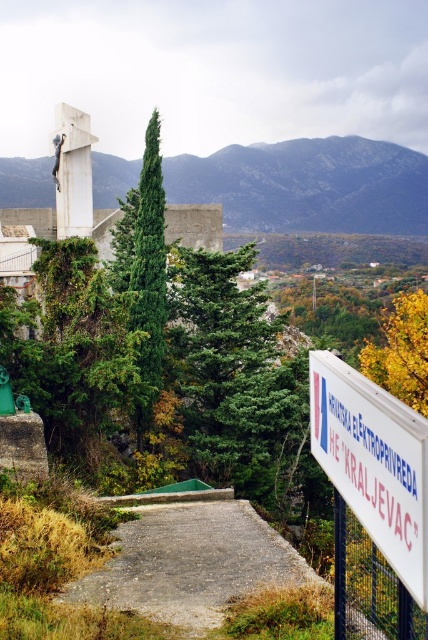
You are a hiker planning to take a photo of the green leafy trees at upper center and the yellow leafy tree at right from the pathway. Which tree should you focus on first if you want to capture the larger tree in your frame?

The green leafy trees at upper center is larger in size than the yellow leafy tree at right, so you should focus on the green leafy trees at upper center first to capture the larger tree in your frame.

You are a hiker standing at the beginning of the gray concrete path at center. You want to know if you can see the white plastic sign at right from your current position. Can you see it?

The gray concrete path at center is taller than the white plastic sign at right, so it might block the view. However, since the path is at the center and the sign is at the right, you might still see the white plastic sign at right if you look to the side. The exact visibility depends on the path and sign heights and angles, but the description doesn